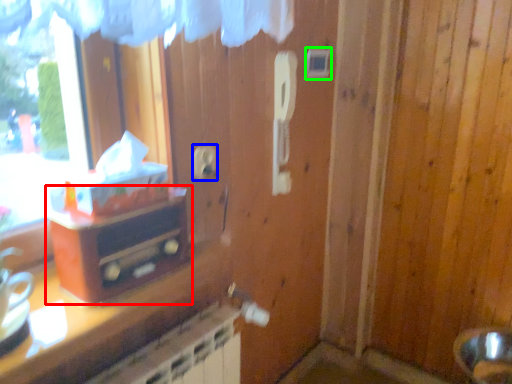
Question: Estimate the real-world distances between objects in this image. Which object is farther from furniture (highlighted by a red box), electric outlet (highlighted by a blue box) or light switch (highlighted by a green box)?

Choices:
 (A) electric outlet
 (B) light switch

Answer: (B)